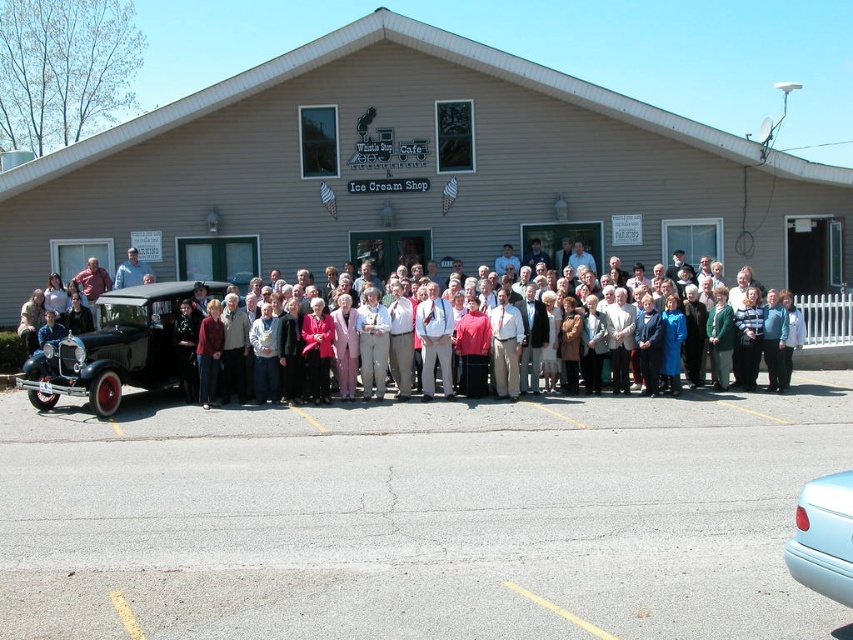
You are standing in front of the Whistle Stop Cafe and Ice Cream Shop. There are two points marked in the scene. Which point is closer to you, point [750,192] or point [691,380]?

Point [691,380] is closer to you because it is less further to the camera than point [750,192].

You are attending an outdoor event at the Whistle Stop Cafe and Ice Cream Shop. You notice the beige siding building at center and the matte pink sweater at center. Which object is located to the left of the other?

The beige siding building at center is positioned on the right side of matte pink sweater at center, so the matte pink sweater at center is to the left of the beige siding building at center.

You are organizing a photo shoot and need to ensure that the beige siding building at center and the matte pink sweater at center are both visible in the frame. Given that the building is wider than the sweater, which object should you prioritize positioning closer to the camera to ensure both fit within the shot?

Since the beige siding building at center is wider than the matte pink sweater at center, you should prioritize positioning the matte pink sweater at center closer to the camera to ensure both fit within the shot.